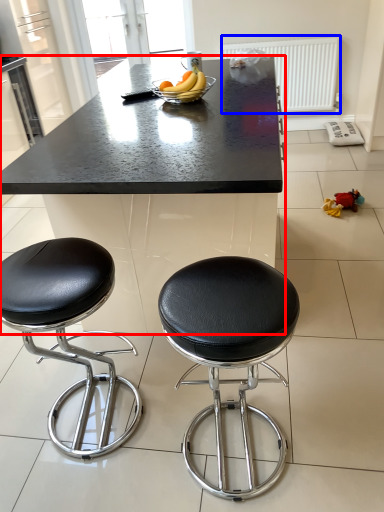
Question: Which of the following is the closest to the observer, table (highlighted by a red box) or radiator (highlighted by a blue box)?

Choices:
 (A) table
 (B) radiator

Answer: (A)